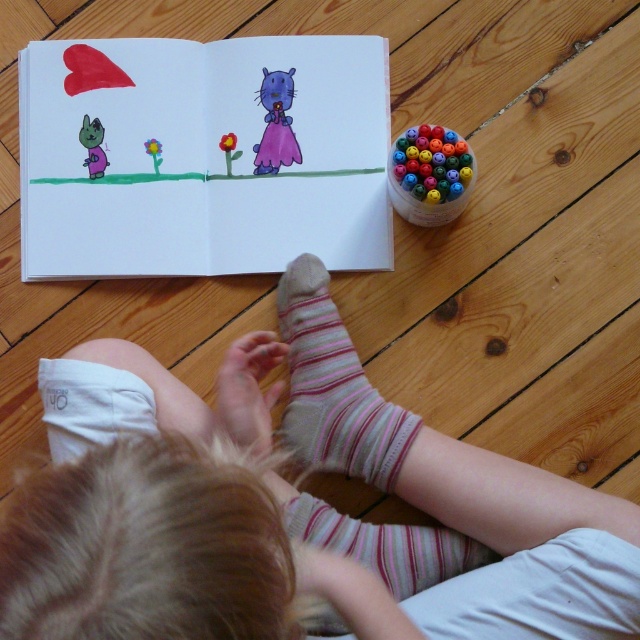
Can you confirm if matte purple cat at left is positioned above smooth red flower at center?

Yes, matte purple cat at left is above smooth red flower at center.

Does matte purple cat at left have a larger size compared to smooth red flower at center?

Indeed, matte purple cat at left has a larger size compared to smooth red flower at center.

Does point (90, 168) come in front of point (241, 154)?

Yes, point (90, 168) is in front of point (241, 154).

Locate an element on the screen. The width and height of the screenshot is (640, 640). matte purple cat at left is located at coordinates (92, 147).

Does point (157, 104) come closer to viewer compared to point (145, 145)?

No, (157, 104) is further to viewer.

Can you confirm if matte paper book at upper center is bigger than yellow paper flower at upper center?

Correct, matte paper book at upper center is larger in size than yellow paper flower at upper center.

Which is in front, point (278, 260) or point (156, 148)?

Point (278, 260)

In order to click on matte paper book at upper center in this screenshot , I will do `click(204, 156)`.

What do you see at coordinates (276, 124) in the screenshot? The width and height of the screenshot is (640, 640). I see `purple matte dress at upper center` at bounding box center [276, 124].

This screenshot has height=640, width=640. In order to click on purple matte dress at upper center in this screenshot , I will do coord(276,124).

Which is in front, point (285, 80) or point (106, 157)?

Positioned in front is point (106, 157).

Image resolution: width=640 pixels, height=640 pixels. What are the coordinates of `purple matte dress at upper center` in the screenshot? It's located at coord(276,124).